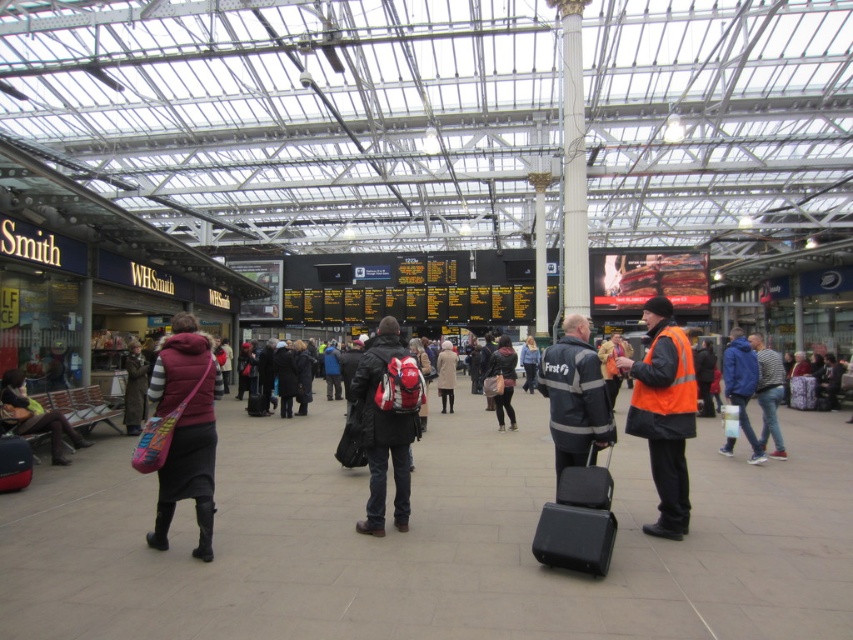
Between point (163, 394) and point (746, 340), which one is positioned behind?

The point (746, 340) is behind.

Is velvet purple vest at left positioned before orange reflective vest at center?

Yes, velvet purple vest at left is closer to the viewer.

Is point (183, 380) farther from camera compared to point (733, 444)?

No, (183, 380) is closer to viewer.

In order to click on velvet purple vest at left in this screenshot , I will do `click(186, 429)`.

Is matte black backpack at center to the left of matte black suitcase at lower left from the viewer's perspective?

Incorrect, matte black backpack at center is not on the left side of matte black suitcase at lower left.

Does matte black backpack at center appear over matte black suitcase at lower left?

Correct, matte black backpack at center is located above matte black suitcase at lower left.

Where is `matte black backpack at center`? Image resolution: width=853 pixels, height=640 pixels. matte black backpack at center is located at coordinates (387, 420).

Locate an element on the screen. matte black backpack at center is located at coordinates (387, 420).

Between light beige coat at center and blue denim jacket at center, which one is positioned higher?

light beige coat at center is above.

Is point (444, 412) closer to viewer compared to point (532, 355)?

That is True.

Where is `light beige coat at center`? light beige coat at center is located at coordinates (445, 376).